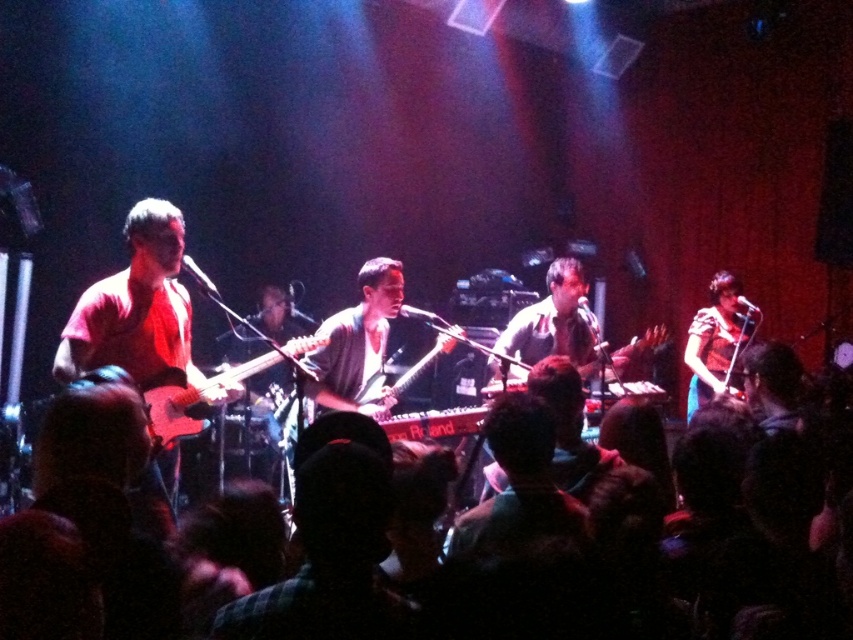
You are a photographer at the live music performance. You want to take a picture of the stage. Where should you position your camera to capture the matte blue dress at right in the frame?

To capture the matte blue dress at right in the frame, position your camera so that it is aligned with the coordinates of the dress, which is located at point (717, 340). This ensures the dress is centered within the camera view.

Consider the image. You are a photographer at the back of the venue. You want to take a photo that includes both the matte blue dress at right and the shiny silver electric guitar at center. Since you can only focus on one subject, which one do you choose to focus on to ensure the other is still visible in the frame?

The matte blue dress at right has a lesser width compared to the shiny silver electric guitar at center. Therefore, you should focus on the shiny silver electric guitar at center because its larger size will remain visible even if the dress is slightly out of focus.